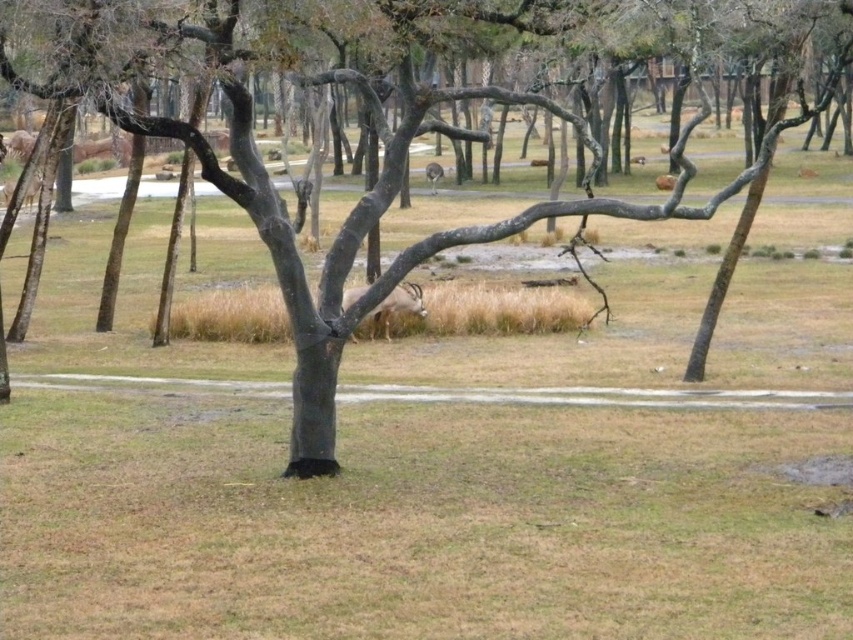
Which is below, brown bark tree at center or brown furry antelope at center?

brown furry antelope at center is below.

Which is in front, point (138, 131) or point (422, 304)?

Point (138, 131) is in front.

Describe the element at coordinates (386, 188) in the screenshot. Image resolution: width=853 pixels, height=640 pixels. I see `brown bark tree at center` at that location.

Where is `brown bark tree at center`? brown bark tree at center is located at coordinates (386, 188).

Based on the photo, between brown furry antelope at center and brown fur antelope at center, which one appears on the left side from the viewer's perspective?

brown furry antelope at center is more to the left.

Who is more forward, (351,289) or (431,188)?

Point (351,289) is in front.

Describe the element at coordinates (397, 305) in the screenshot. The height and width of the screenshot is (640, 853). I see `brown furry antelope at center` at that location.

Where is `brown furry antelope at center`? This screenshot has width=853, height=640. brown furry antelope at center is located at coordinates (397, 305).

Can you confirm if brown bark tree at center is positioned below brown fur antelope at center?

Indeed, brown bark tree at center is positioned under brown fur antelope at center.

Who is more forward, (428, 244) or (434, 186)?

Point (428, 244)

Who is more distant from viewer, (x=758, y=161) or (x=434, y=176)?

The point (x=434, y=176) is more distant.

The width and height of the screenshot is (853, 640). Find the location of `brown bark tree at center`. brown bark tree at center is located at coordinates (386, 188).